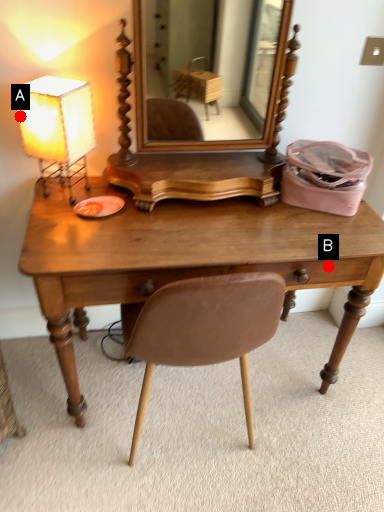
Question: Two points are circled on the image, labeled by A and B beside each circle. Which point is farther from the camera taking this photo?

Choices:
 (A) A is further
 (B) B is further

Answer: (B)